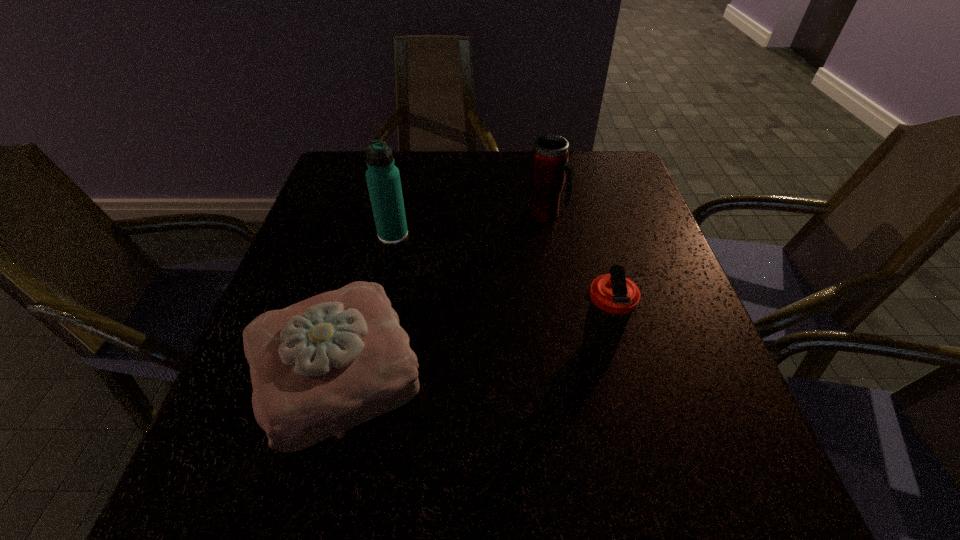
The image size is (960, 540). Find the location of `free space at the left edge`. free space at the left edge is located at coordinates (285, 291).

Identify the location of free point at the right edge. (609, 268).

In the image, there is a desktop. In order to click on free region at the near left corner in this screenshot , I will do `click(182, 508)`.

Where is `free spot at the far right corner of the desktop`? free spot at the far right corner of the desktop is located at coordinates (x=598, y=160).

You are a GUI agent. You are given a task and a screenshot of the screen. Output one action in this format:
    pyautogui.click(x=<x>, y=<y>)
    Task: Click on the empty space that is in between the nearest thermos bottle and the tallest object
    This screenshot has height=540, width=960.
    Given the screenshot: What is the action you would take?
    pyautogui.click(x=494, y=293)

Locate an element on the screen. Image resolution: width=960 pixels, height=540 pixels. empty space between the leftmost thermos bottle and the nearest thermos bottle is located at coordinates (494, 293).

Locate an element on the screen. This screenshot has width=960, height=540. vacant region between the nearest thermos bottle and the shortest object is located at coordinates (466, 361).

The image size is (960, 540). Identify the location of free space that is in between the leftmost thermos bottle and the nearest thermos bottle. (494, 293).

You are a GUI agent. You are given a task and a screenshot of the screen. Output one action in this format:
    pyautogui.click(x=<x>, y=<y>)
    Task: Click on the closest object to the nearest thermos bottle
    The width and height of the screenshot is (960, 540).
    Given the screenshot: What is the action you would take?
    pyautogui.click(x=322, y=366)

Where is `object that is the second closest to the nearest thermos bottle`? This screenshot has width=960, height=540. object that is the second closest to the nearest thermos bottle is located at coordinates (549, 170).